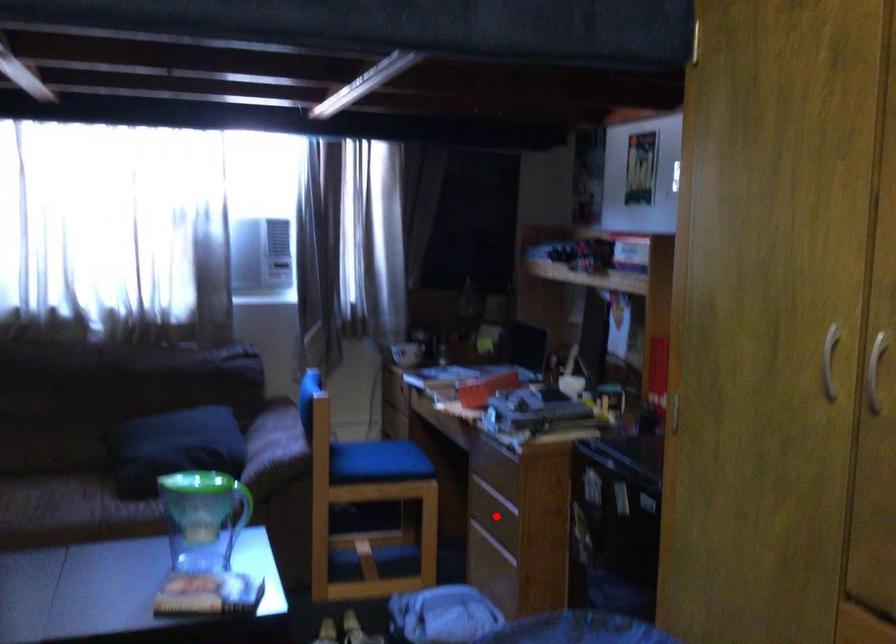
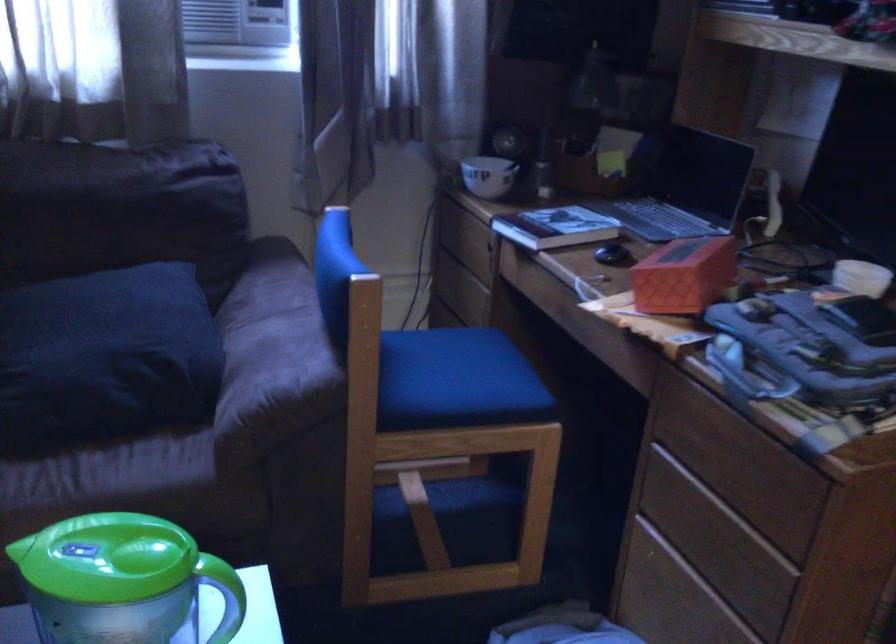
Question: I am providing you with two images of the same scene from different viewpoints. Given a red point in image1, look at the same physical point in image2. Is it:

Choices:
 (A) Closer to the viewpoint
 (B) Farther from the viewpoint

Answer: (A)